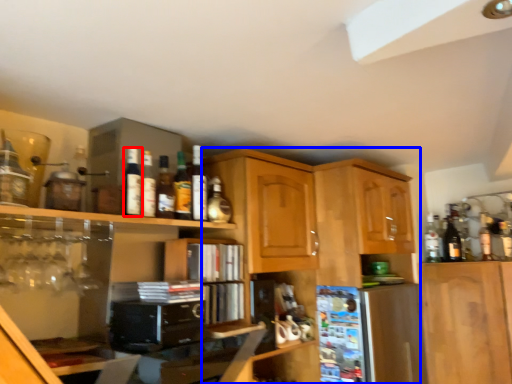
Question: Among these objects, which one is nearest to the camera, bottle (highlighted by a red box) or cabinetry (highlighted by a blue box)?

Choices:
 (A) bottle
 (B) cabinetry

Answer: (A)